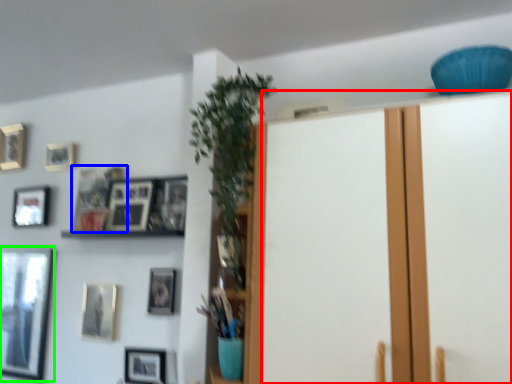
Question: Considering the real-world distances, which object is farthest from door (highlighted by a red box)? picture frame (highlighted by a blue box) or picture frame (highlighted by a green box)?

Choices:
 (A) picture frame
 (B) picture frame

Answer: (B)